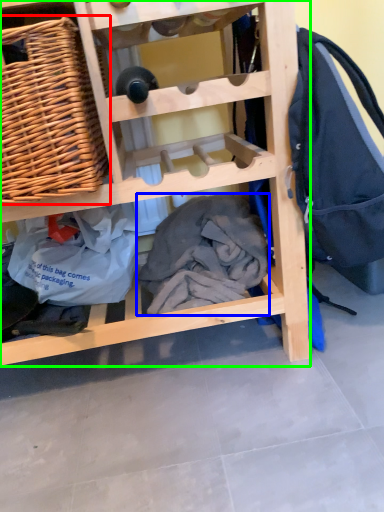
Question: Which object is the closest to the picnic basket (highlighted by a red box)? Choose among these: clothing (highlighted by a blue box) or furniture (highlighted by a green box).

Choices:
 (A) clothing
 (B) furniture

Answer: (B)